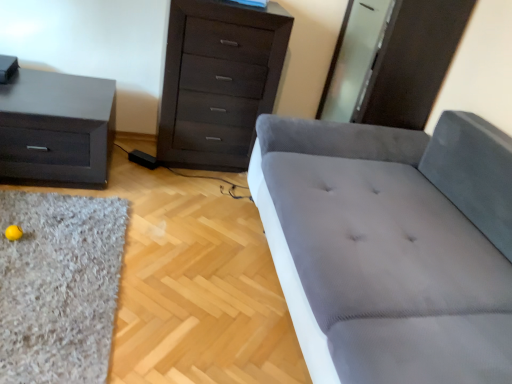
Question: Does matte black nightstand at left have a greater height compared to shaggy gray rug at lower left?

Choices:
 (A) yes
 (B) no

Answer: (A)

Question: Is matte black nightstand at left in front of shaggy gray rug at lower left?

Choices:
 (A) yes
 (B) no

Answer: (B)

Question: Is matte black nightstand at left further to camera compared to shaggy gray rug at lower left?

Choices:
 (A) no
 (B) yes

Answer: (B)

Question: Can you confirm if matte black nightstand at left is thinner than shaggy gray rug at lower left?

Choices:
 (A) no
 (B) yes

Answer: (A)

Question: Is matte black nightstand at left aimed at shaggy gray rug at lower left?

Choices:
 (A) no
 (B) yes

Answer: (B)

Question: Is the surface of matte black nightstand at left in direct contact with shaggy gray rug at lower left?

Choices:
 (A) yes
 (B) no

Answer: (B)

Question: Does gray fabric studio couch at center have a lesser height compared to matte black nightstand at left?

Choices:
 (A) no
 (B) yes

Answer: (A)

Question: From a real-world perspective, is gray fabric studio couch at center physically above matte black nightstand at left?

Choices:
 (A) no
 (B) yes

Answer: (B)

Question: Is gray fabric studio couch at center to the right of matte black nightstand at left from the viewer's perspective?

Choices:
 (A) no
 (B) yes

Answer: (B)

Question: Considering the relative sizes of gray fabric studio couch at center and matte black nightstand at left in the image provided, is gray fabric studio couch at center wider than matte black nightstand at left?

Choices:
 (A) no
 (B) yes

Answer: (B)

Question: Is gray fabric studio couch at center positioned in front of matte black nightstand at left?

Choices:
 (A) yes
 (B) no

Answer: (A)

Question: Is gray fabric studio couch at center looking in the opposite direction of matte black nightstand at left?

Choices:
 (A) yes
 (B) no

Answer: (B)

Question: From a real-world perspective, is gray fabric studio couch at center on top of dark wood chest of drawers at upper center?

Choices:
 (A) yes
 (B) no

Answer: (B)